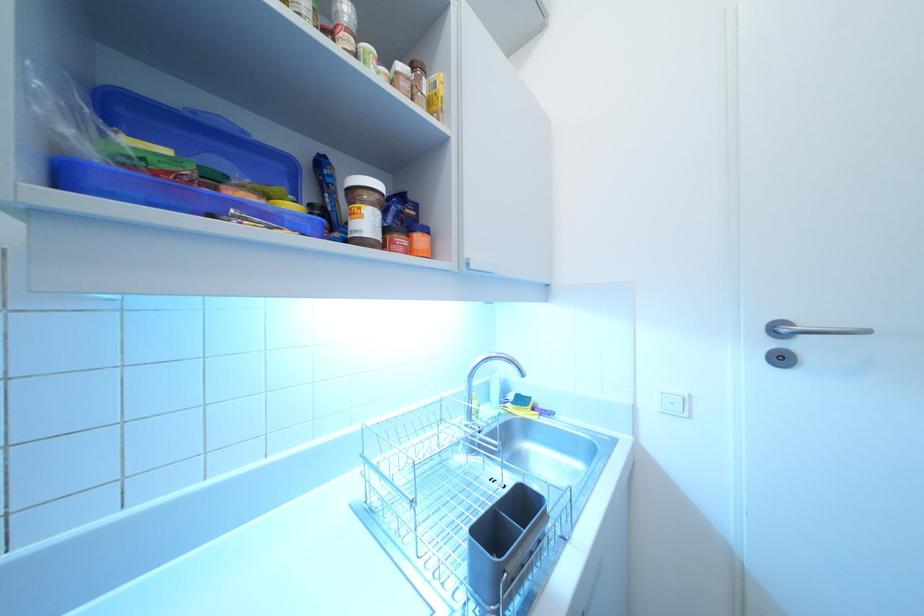
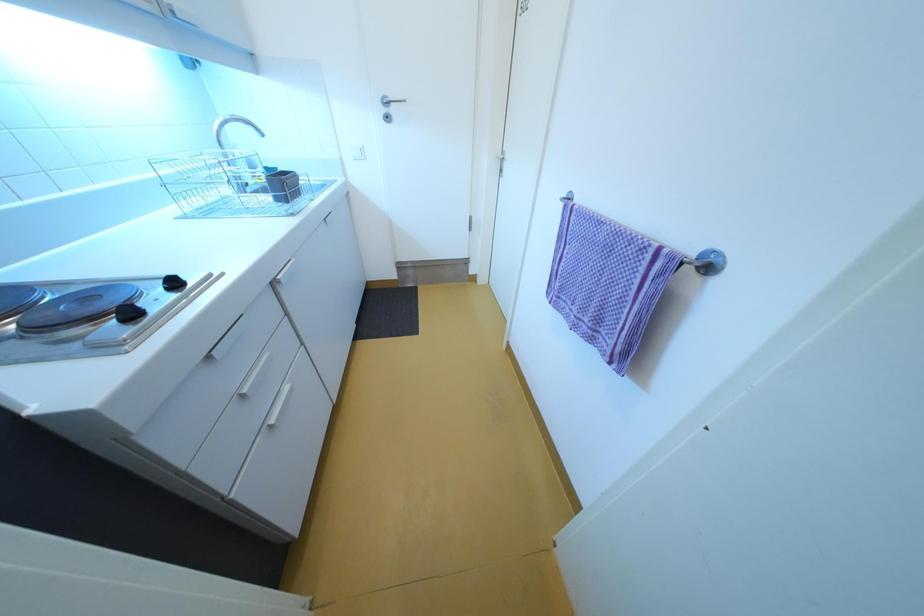
The first image is from the beginning of the video and the second image is from the end. How did the camera likely rotate when shooting the video?

The camera rotated toward right-down.